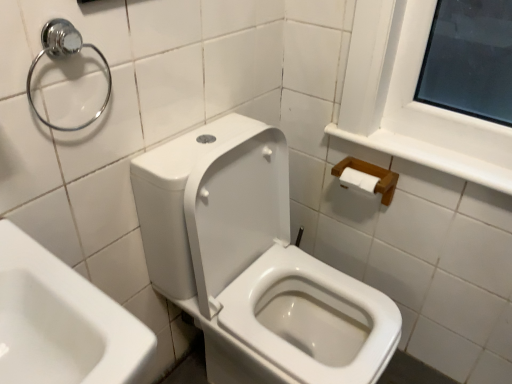
Where is `wooden tissue holder at upper right`? Image resolution: width=512 pixels, height=384 pixels. wooden tissue holder at upper right is located at coordinates (431, 157).

How different are the orientations of white glossy toilet at center and chrome metallic towel ring at upper left in degrees?

white glossy toilet at center and chrome metallic towel ring at upper left are facing 2.34 degrees away from each other.

Can you confirm if white glossy toilet at center is smaller than chrome metallic towel ring at upper left?

No.

Between white glossy toilet at center and chrome metallic towel ring at upper left, which one has less height?

Standing shorter between the two is chrome metallic towel ring at upper left.

How many degrees apart are the facing directions of white glossy toilet at center and wooden tissue holder at upper right?

white glossy toilet at center and wooden tissue holder at upper right are facing 89.5 degrees away from each other.

From the picture: Is white glossy toilet at center positioned behind wooden tissue holder at upper right?

No, it is in front of wooden tissue holder at upper right.

Is point (306, 311) closer or farther from the camera than point (405, 148)?

Point (306, 311).

You are a GUI agent. You are given a task and a screenshot of the screen. Output one action in this format:
    pyautogui.click(x=<x>, y=<y>)
    Task: Click on the toilet that appears below the wooden tissue holder at upper right (from the image's perspective)
    Image resolution: width=512 pixels, height=384 pixels.
    Given the screenshot: What is the action you would take?
    pyautogui.click(x=253, y=263)

How different are the orientations of wooden tissue holder at upper right and white glossy toilet at center in degrees?

89.5 degrees separate the facing orientations of wooden tissue holder at upper right and white glossy toilet at center.

Does wooden tissue holder at upper right appear on the left side of white glossy toilet at center?

Incorrect, wooden tissue holder at upper right is not on the left side of white glossy toilet at center.

Is wooden tissue holder at upper right positioned far away from white glossy toilet at center?

No, wooden tissue holder at upper right is not far from white glossy toilet at center.

Is wooden tissue holder at upper right in front of white glossy toilet at center?

No, wooden tissue holder at upper right is behind white glossy toilet at center.

Is chrome metallic towel ring at upper left inside or outside of white glossy toilet at center?

chrome metallic towel ring at upper left lies outside white glossy toilet at center.

How many degrees apart are the facing directions of chrome metallic towel ring at upper left and white glossy toilet at center?

chrome metallic towel ring at upper left and white glossy toilet at center are facing 2.34 degrees away from each other.

Is chrome metallic towel ring at upper left touching white glossy toilet at center?

No, chrome metallic towel ring at upper left is not touching white glossy toilet at center.

Which of these two, chrome metallic towel ring at upper left or wooden tissue holder at upper right, is wider?

With larger width is wooden tissue holder at upper right.

How different are the orientations of chrome metallic towel ring at upper left and wooden tissue holder at upper right in degrees?

The facing directions of chrome metallic towel ring at upper left and wooden tissue holder at upper right are 91.8 degrees apart.

Is chrome metallic towel ring at upper left positioned beyond the bounds of wooden tissue holder at upper right?

Yes, chrome metallic towel ring at upper left is outside of wooden tissue holder at upper right.

Considering the relative sizes of chrome metallic towel ring at upper left and wooden tissue holder at upper right in the image provided, is chrome metallic towel ring at upper left smaller than wooden tissue holder at upper right?

Correct, chrome metallic towel ring at upper left occupies less space than wooden tissue holder at upper right.

From a real-world perspective, who is located higher, wooden tissue holder at upper right or chrome metallic towel ring at upper left?

In real-world perspective, chrome metallic towel ring at upper left is above.

Is wooden tissue holder at upper right positioned far away from chrome metallic towel ring at upper left?

Actually, wooden tissue holder at upper right and chrome metallic towel ring at upper left are a little close together.

From the image's perspective, which one is positioned higher, wooden tissue holder at upper right or chrome metallic towel ring at upper left?

chrome metallic towel ring at upper left is shown above in the image.

Where is `toilet below the chrome metallic towel ring at upper left (from a real-world perspective)`? toilet below the chrome metallic towel ring at upper left (from a real-world perspective) is located at coordinates (253, 263).

Locate an element on the screen. The width and height of the screenshot is (512, 384). toilet in front of the wooden tissue holder at upper right is located at coordinates (253, 263).

Which object lies nearer to the anchor point wooden tissue holder at upper right, chrome metallic towel ring at upper left or white glossy toilet at center?

Among the two, white glossy toilet at center is located nearer to wooden tissue holder at upper right.

Looking at the image, which one is located further to chrome metallic towel ring at upper left, wooden tissue holder at upper right or white glossy toilet at center?

wooden tissue holder at upper right is positioned further to the anchor chrome metallic towel ring at upper left.

Considering their positions, is white glossy toilet at center positioned closer to chrome metallic towel ring at upper left than wooden tissue holder at upper right?

white glossy toilet at center is positioned closer to the anchor chrome metallic towel ring at upper left.

Looking at the image, which one is located closer to white glossy toilet at center, chrome metallic towel ring at upper left or wooden tissue holder at upper right?

Among the two, wooden tissue holder at upper right is located nearer to white glossy toilet at center.

Which object lies further to the anchor point wooden tissue holder at upper right, white glossy toilet at center or chrome metallic towel ring at upper left?

The object further to wooden tissue holder at upper right is chrome metallic towel ring at upper left.

From the picture: Based on their spatial positions, is wooden tissue holder at upper right or chrome metallic towel ring at upper left closer to white glossy toilet at center?

wooden tissue holder at upper right is closer to white glossy toilet at center.

Locate an element on the screen. The height and width of the screenshot is (384, 512). toilet located between chrome metallic towel ring at upper left and wooden tissue holder at upper right in the left-right direction is located at coordinates (253, 263).